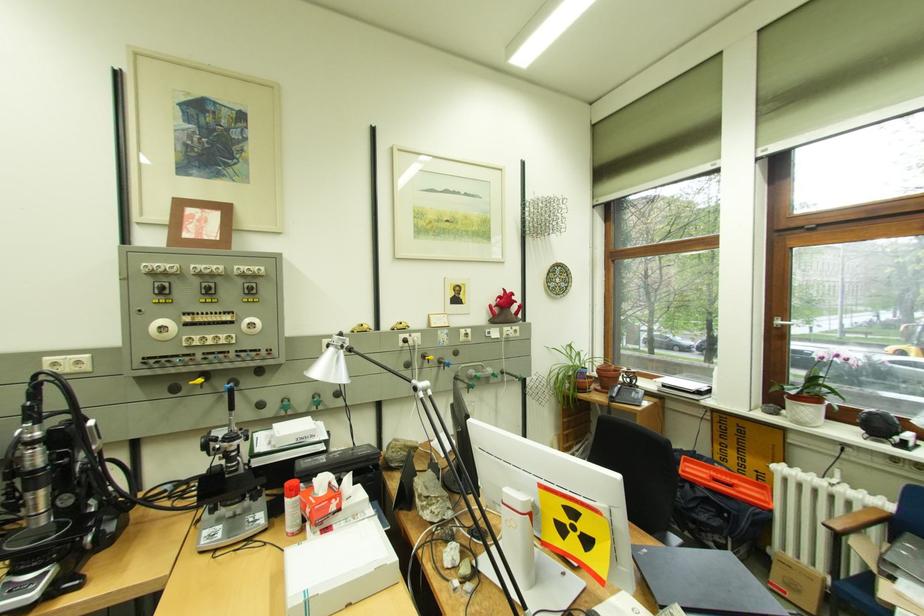
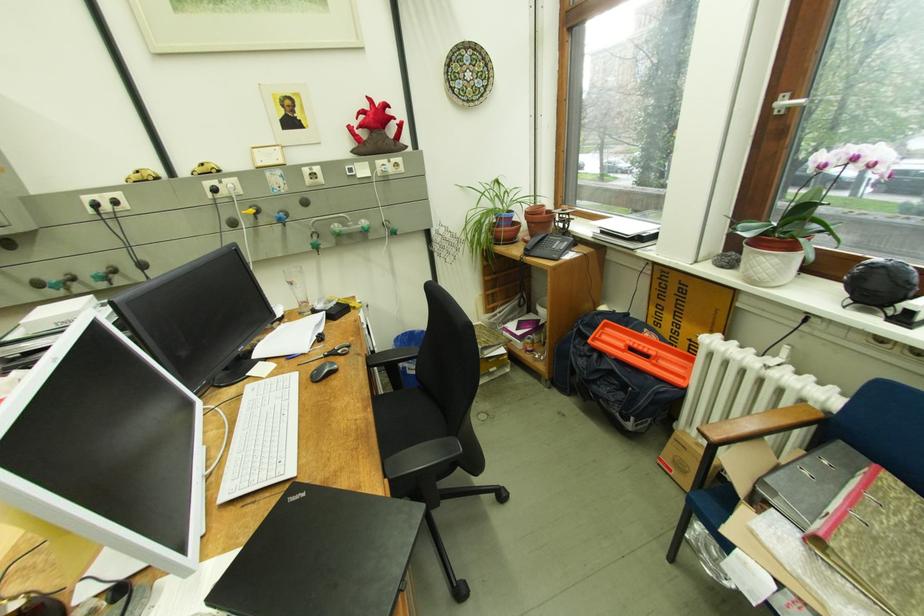
What movement of the cameraman would produce the second image?

The movement direction of the cameraman is right, forward.